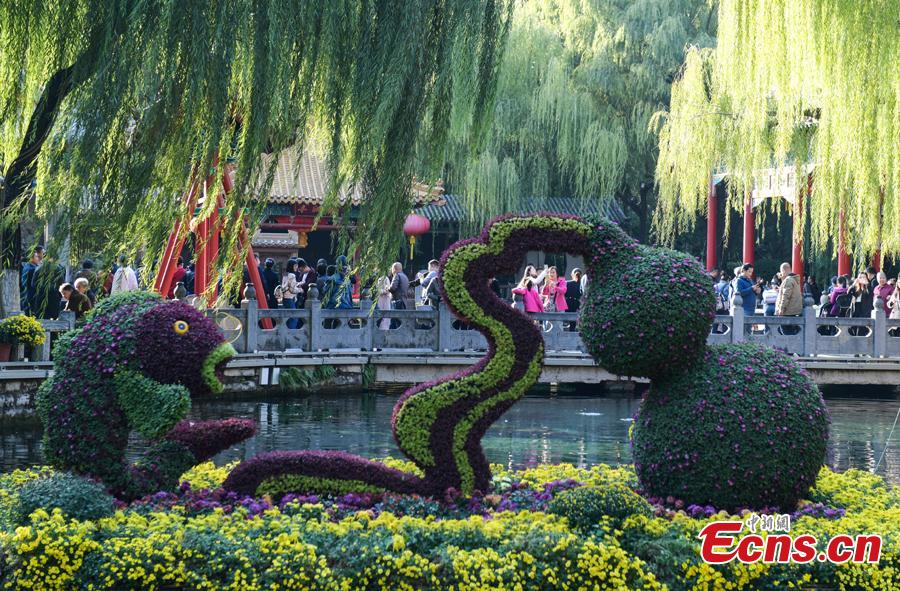
Locate an element on the screen. pillar is located at coordinates (749, 229).